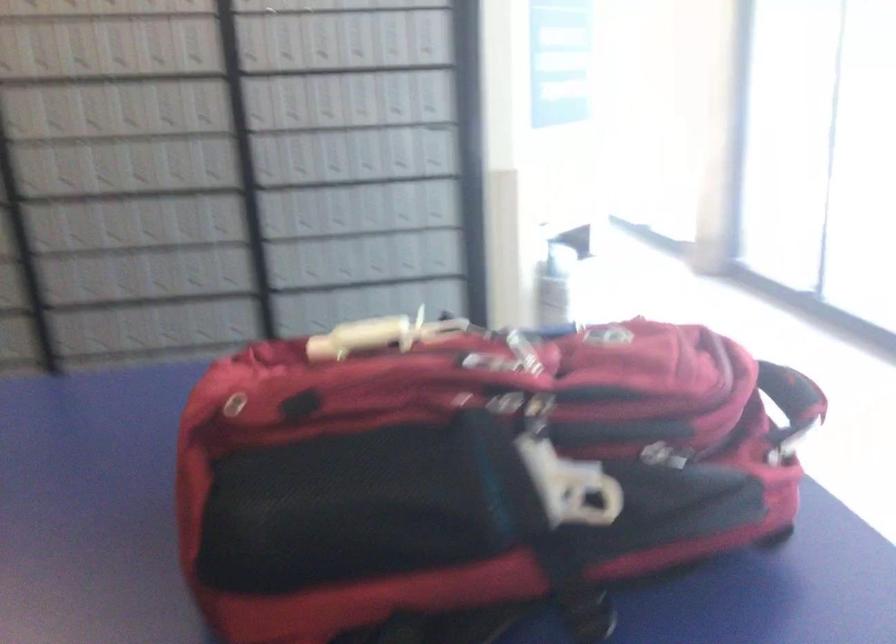
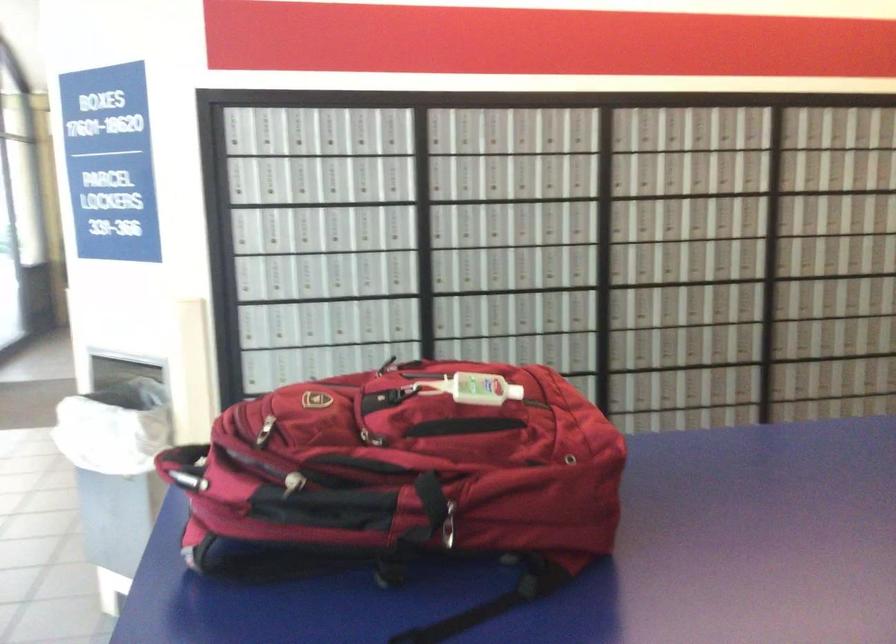
Find the pixel in the second image that matches point (616, 325) in the first image.

(264, 430)